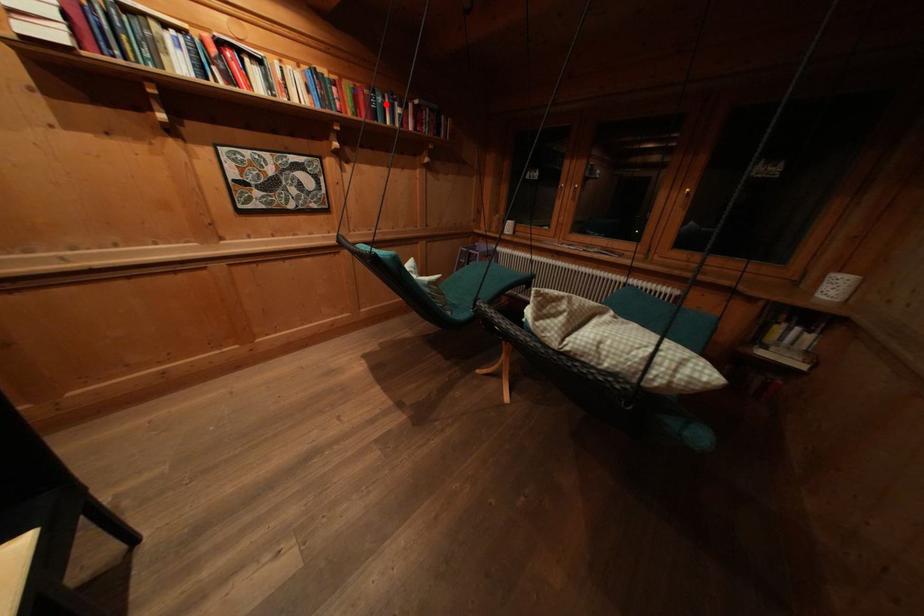
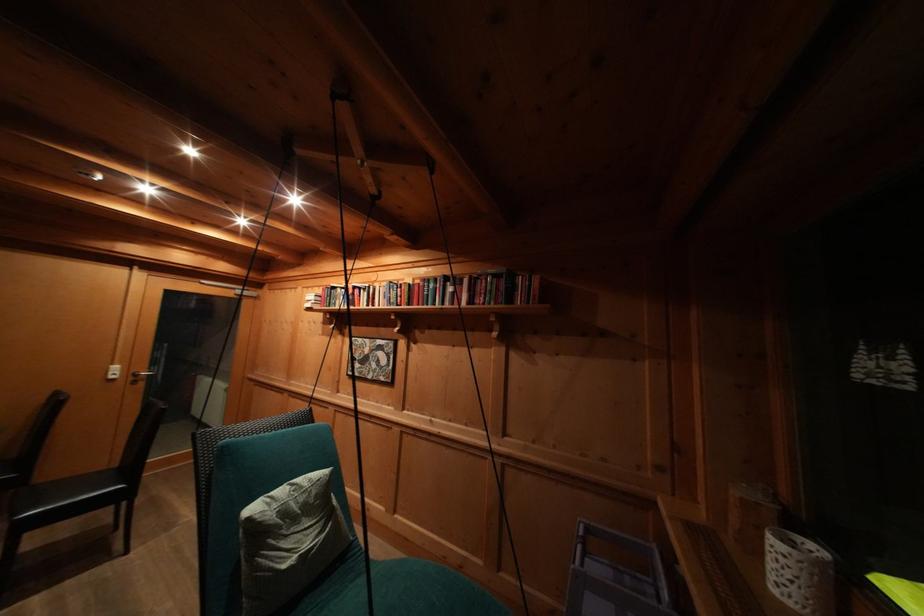
The point at the highlighted location is marked in the first image. Where is the corresponding point in the second image?

(438, 291)